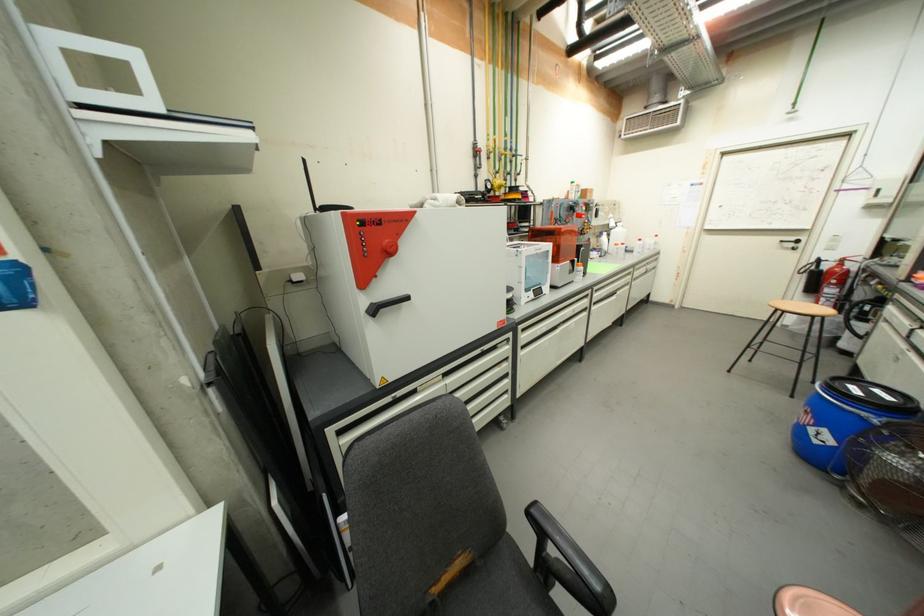
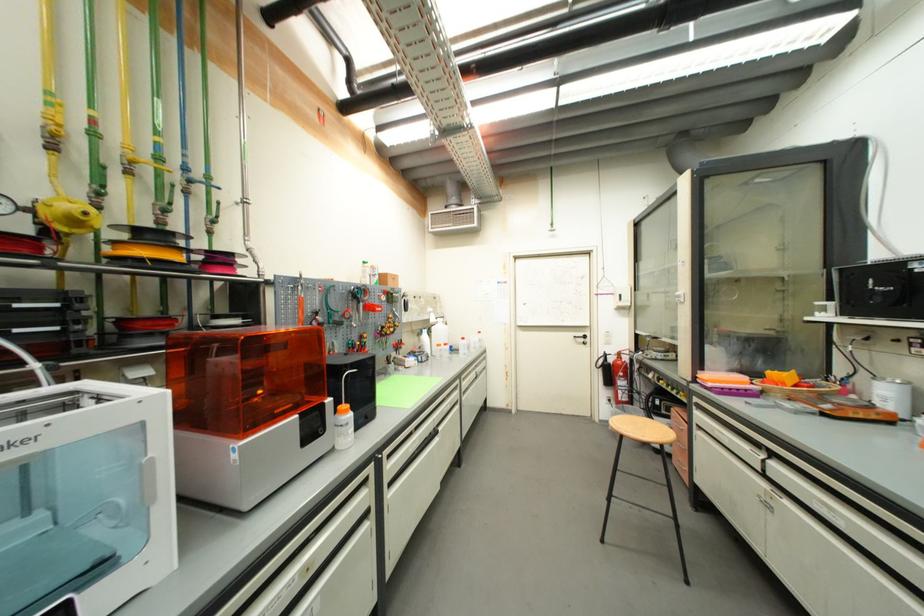
Locate, in the second image, the point that corresponds to (839,283) in the first image.

(626, 376)